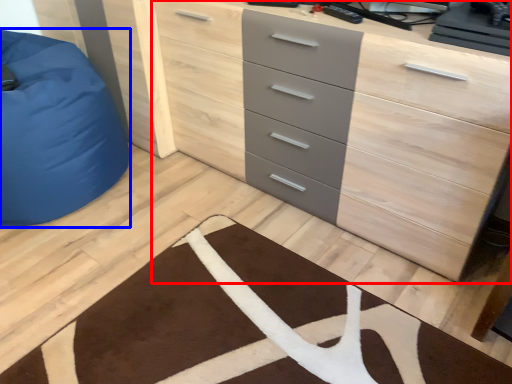
Question: Which point is closer to the camera, chest of drawers (highlighted by a red box) or furniture (highlighted by a blue box)?

Choices:
 (A) chest of drawers
 (B) furniture

Answer: (A)